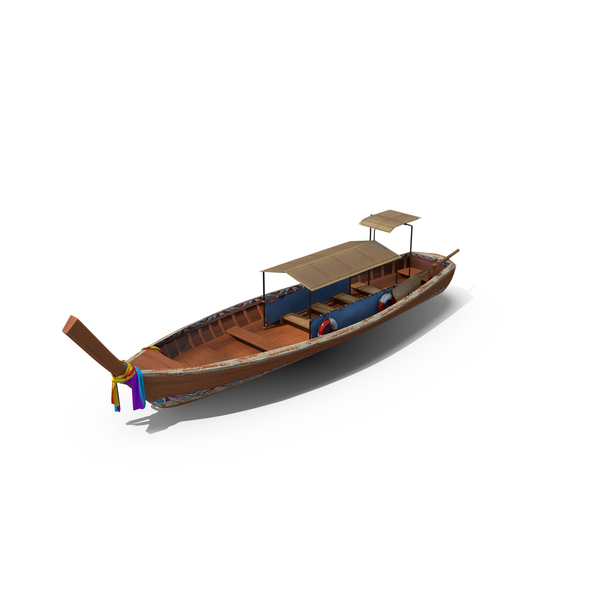
You are a GUI agent. You are given a task and a screenshot of the screen. Output one action in this format:
    pyautogui.click(x=<x>, y=<y>)
    Task: Click on the vertical supports
    
    Given the screenshot: What is the action you would take?
    pyautogui.click(x=210, y=332), pyautogui.click(x=204, y=335), pyautogui.click(x=193, y=338), pyautogui.click(x=177, y=349), pyautogui.click(x=217, y=328), pyautogui.click(x=233, y=322)